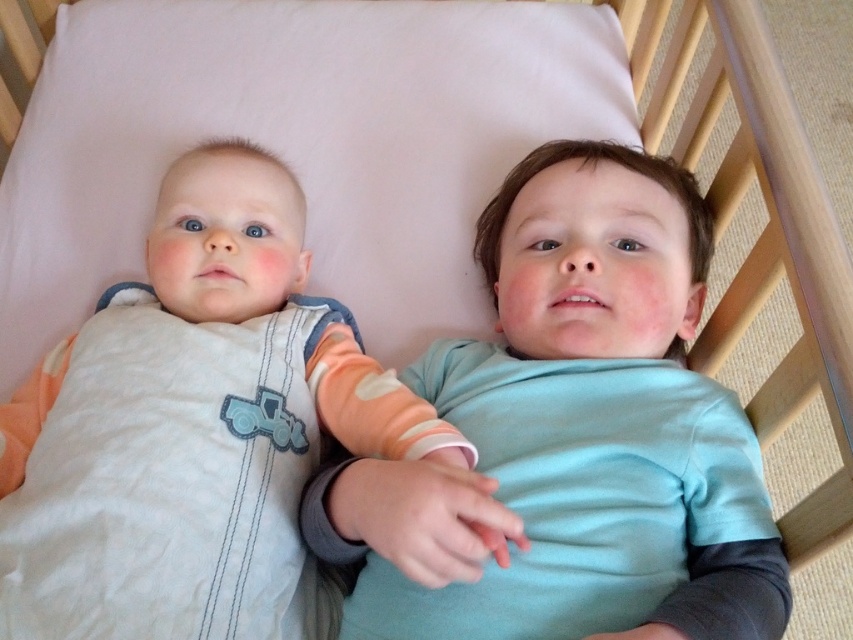
Can you confirm if matte blue shirt at center is positioned above white cotton onesie at center?

Correct, matte blue shirt at center is located above white cotton onesie at center.

Can you confirm if matte blue shirt at center is bigger than white cotton onesie at center?

Indeed, matte blue shirt at center has a larger size compared to white cotton onesie at center.

Is point (518, 257) positioned before point (221, 577)?

That is False.

Identify the location of matte blue shirt at center. pyautogui.click(x=572, y=436).